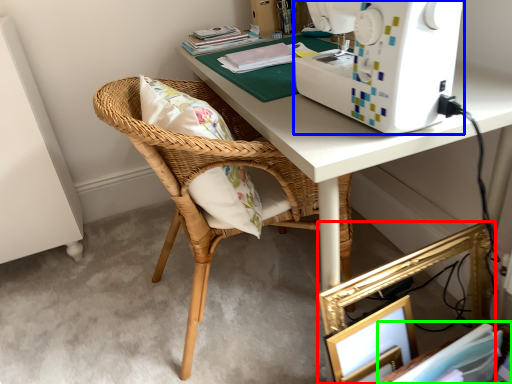
Question: Estimate the real-world distances between objects in this image. Which object is farther from picture frame (highlighted by a red box), sewing machine (highlighted by a blue box) or book (highlighted by a green box)?

Choices:
 (A) sewing machine
 (B) book

Answer: (A)